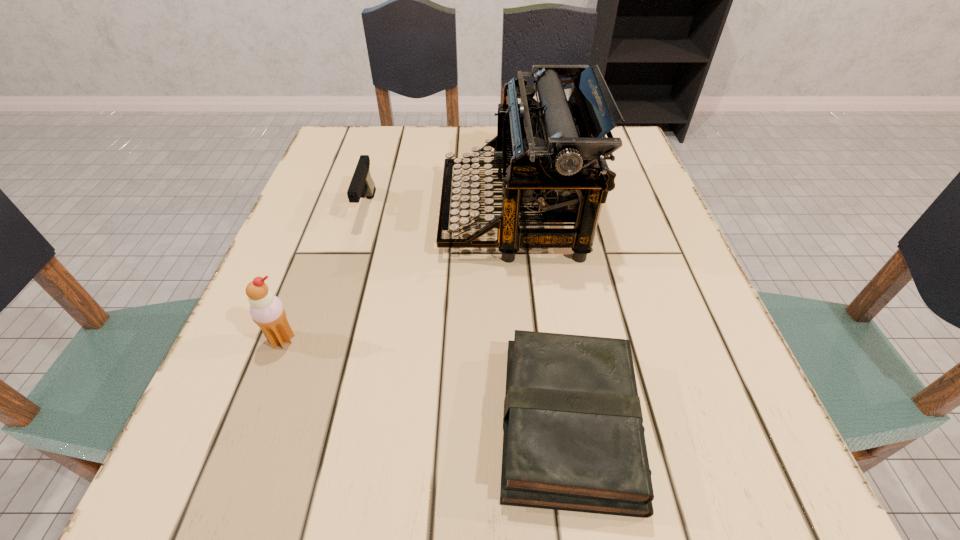
Select which object appears as the closest to the shortest object. Please provide its 2D coordinates. Your answer should be formatted as a tuple, i.e. [(x, y)], where the tuple contains the x and y coordinates of a point satisfying the conditions above.

[(551, 152)]

Where is `the closest object to the tallest object`? the closest object to the tallest object is located at coordinates (362, 184).

Where is `vacant position in the image that satisfies the following two spatial constraints: 1. on the typing side of the book; 2. on the left side of the typewriter`? vacant position in the image that satisfies the following two spatial constraints: 1. on the typing side of the book; 2. on the left side of the typewriter is located at coordinates (531, 423).

Identify the location of free location that satisfies the following two spatial constraints: 1. on the front-facing side of the shortest object; 2. on the right side of the second shortest object. (304, 423).

You are a GUI agent. You are given a task and a screenshot of the screen. Output one action in this format:
    pyautogui.click(x=<x>, y=<y>)
    Task: Click on the blank space that satisfies the following two spatial constraints: 1. on the typing side of the tallest object; 2. at the front with a straw on the third shortest object
    The width and height of the screenshot is (960, 540).
    Given the screenshot: What is the action you would take?
    pyautogui.click(x=524, y=340)

Locate an element on the screen. The image size is (960, 540). vacant space that satisfies the following two spatial constraints: 1. on the typing side of the shortest object; 2. on the right side of the typewriter is located at coordinates (531, 423).

You are a GUI agent. You are given a task and a screenshot of the screen. Output one action in this format:
    pyautogui.click(x=<x>, y=<y>)
    Task: Click on the free location that satisfies the following two spatial constraints: 1. on the back side of the book; 2. on the typing side of the tallest object
    Image resolution: width=960 pixels, height=540 pixels.
    Given the screenshot: What is the action you would take?
    pyautogui.click(x=539, y=214)

Identify the location of vacant space that satisfies the following two spatial constraints: 1. at the front with a straw on the shortest object; 2. on the left side of the icecream. The width and height of the screenshot is (960, 540). (251, 423).

The image size is (960, 540). Find the location of `free region that satisfies the following two spatial constraints: 1. on the front-facing side of the shortest object; 2. on the right side of the second shortest object`. free region that satisfies the following two spatial constraints: 1. on the front-facing side of the shortest object; 2. on the right side of the second shortest object is located at coordinates (304, 423).

You are a GUI agent. You are given a task and a screenshot of the screen. Output one action in this format:
    pyautogui.click(x=<x>, y=<y>)
    Task: Click on the free spot that satisfies the following two spatial constraints: 1. on the front-facing side of the pistol; 2. on the right side of the shortest object
    The height and width of the screenshot is (540, 960).
    Given the screenshot: What is the action you would take?
    pyautogui.click(x=304, y=423)